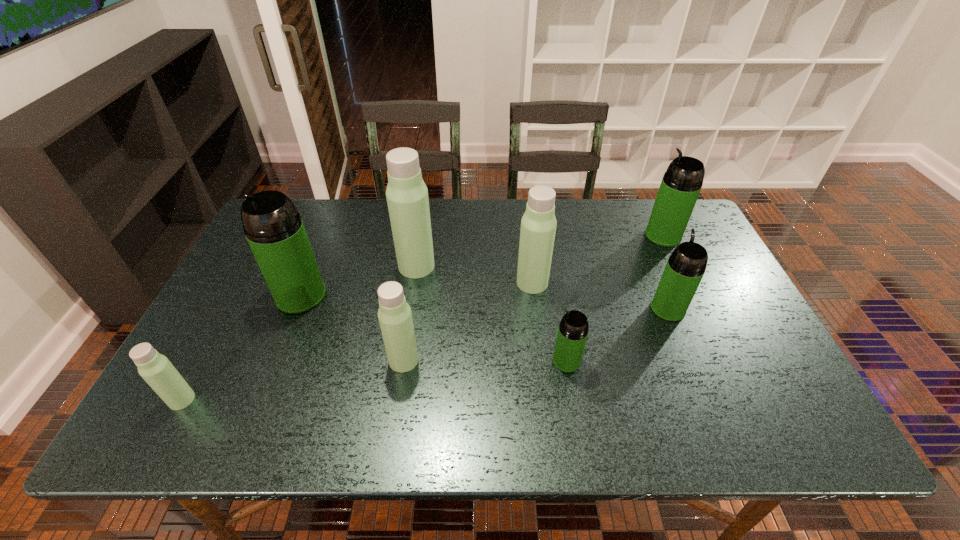
Locate an element on the screen. The height and width of the screenshot is (540, 960). vacant space in between the second green thermos bottle from left to right and the nearest light thermos bottle is located at coordinates (374, 380).

The image size is (960, 540). I want to click on unoccupied position between the smallest green thermos bottle and the nearest object, so click(x=374, y=380).

Find the location of `free point between the biggest light thermos bottle and the second thermos bottle from left to right`. free point between the biggest light thermos bottle and the second thermos bottle from left to right is located at coordinates (359, 281).

At what (x,y) coordinates should I click in order to perform the action: click on vacant area between the leftmost green thermos bottle and the third farthest light thermos bottle. Please return your answer as a coordinate pair (x, y). Image resolution: width=960 pixels, height=540 pixels. Looking at the image, I should click on (352, 328).

Identify the location of object that stands as the second closest to the biggest light thermos bottle. (538, 225).

Identify which object is the fifth nearest to the second nearest light thermos bottle. Please provide its 2D coordinates. Your answer should be formatted as a tuple, i.e. [(x, y)], where the tuple contains the x and y coordinates of a point satisfying the conditions above.

[(156, 369)]

Identify the location of thermos bottle that is the fifth closest to the third biggest light thermos bottle. The height and width of the screenshot is (540, 960). (156, 369).

Image resolution: width=960 pixels, height=540 pixels. Identify the location of thermos bottle that is the closest one to the smallest light thermos bottle. (273, 227).

Identify which green thermos bottle is located as the fourth nearest to the third farthest light thermos bottle. Please provide its 2D coordinates. Your answer should be formatted as a tuple, i.e. [(x, y)], where the tuple contains the x and y coordinates of a point satisfying the conditions above.

[(681, 184)]

Identify which green thermos bottle is the closest to the farthest object. Please provide its 2D coordinates. Your answer should be formatted as a tuple, i.e. [(x, y)], where the tuple contains the x and y coordinates of a point satisfying the conditions above.

[(684, 270)]